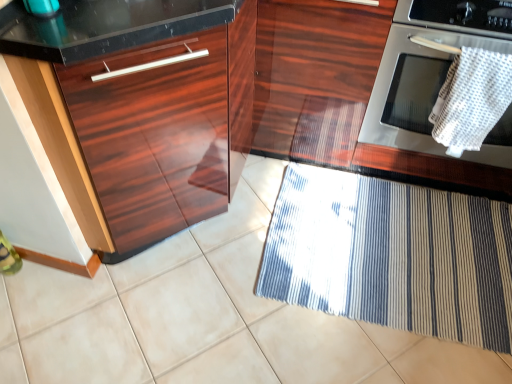
Question: From the image's perspective, relative to glossy wood cabinet at center, acting as the first cabinetry starting from the right, is glossy wood cabinet at center, marked as the first cabinetry in a left-to-right arrangement, above or below?

Choices:
 (A) below
 (B) above

Answer: (A)

Question: Considering the positions of point pyautogui.click(x=507, y=170) and point pyautogui.click(x=274, y=130), is point pyautogui.click(x=507, y=170) closer or farther from the camera than point pyautogui.click(x=274, y=130)?

Choices:
 (A) farther
 (B) closer

Answer: (B)

Question: Estimate the real-world distances between objects in this image. Which object is closer to the glossy wood cabinet at center, placed as the 2th cabinetry when sorted from left to right?

Choices:
 (A) white woven towel at upper right
 (B) stainless steel oven at right
 (C) brushed metal kettle at upper left
 (D) glossy wood drawer at left
 (E) glossy wood cabinet at center, placed as the 2th cabinetry when sorted from right to left

Answer: (E)

Question: Which of these objects is positioned farthest from the stainless steel oven at right?

Choices:
 (A) glossy wood cabinet at center, placed as the 2th cabinetry when sorted from left to right
 (B) glossy wood cabinet at center, marked as the first cabinetry in a left-to-right arrangement
 (C) blue striped mat at lower right
 (D) white woven towel at upper right
 (E) brushed metal kettle at upper left

Answer: (E)